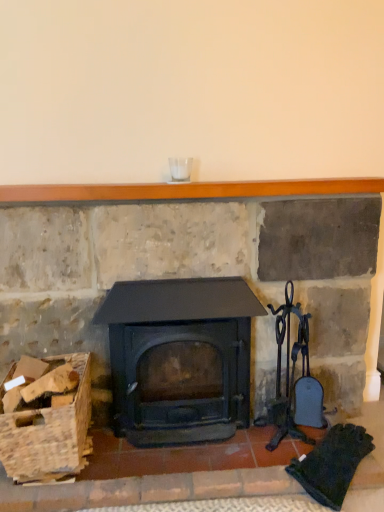
Locate an element on the screen. The height and width of the screenshot is (512, 384). vacant space that is in between wooden crate at lower left and matte black wood burning stove at center is located at coordinates (161, 462).